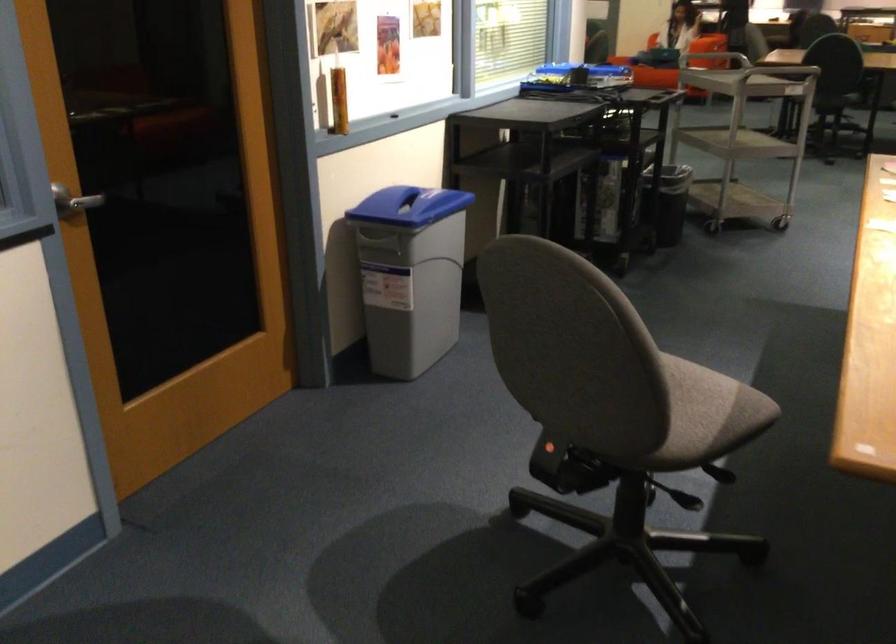
The image size is (896, 644). What do you see at coordinates (406, 207) in the screenshot?
I see `the blue lid opening` at bounding box center [406, 207].